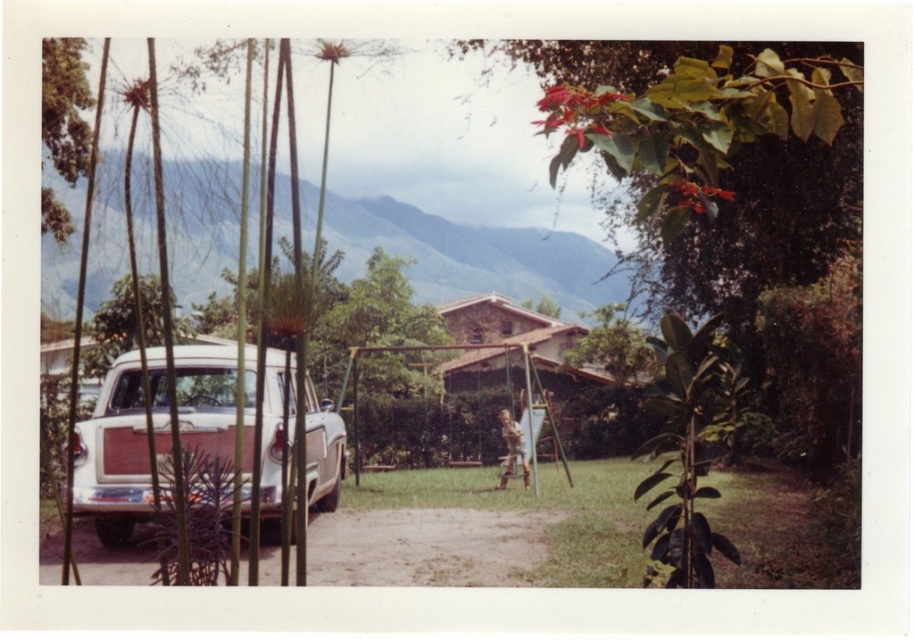
You are a delivery person trying to park a truck that is 6 meters long in the space between the matte white station wagon at left and the green leafy tree at upper left. Can the truck fit there?

The distance between the matte white station wagon at left and the green leafy tree at upper left is 9.30 meters. Since the truck is 6 meters long, there is enough space for it to fit between them.

You are a photographer trying to capture the matte white station wagon at left and the green leafy tree at upper left in the same frame. Given their sizes, which object will appear bigger in your photo?

The matte white station wagon at left will appear bigger in the photo because it has a larger size compared to the green leafy tree at upper left.